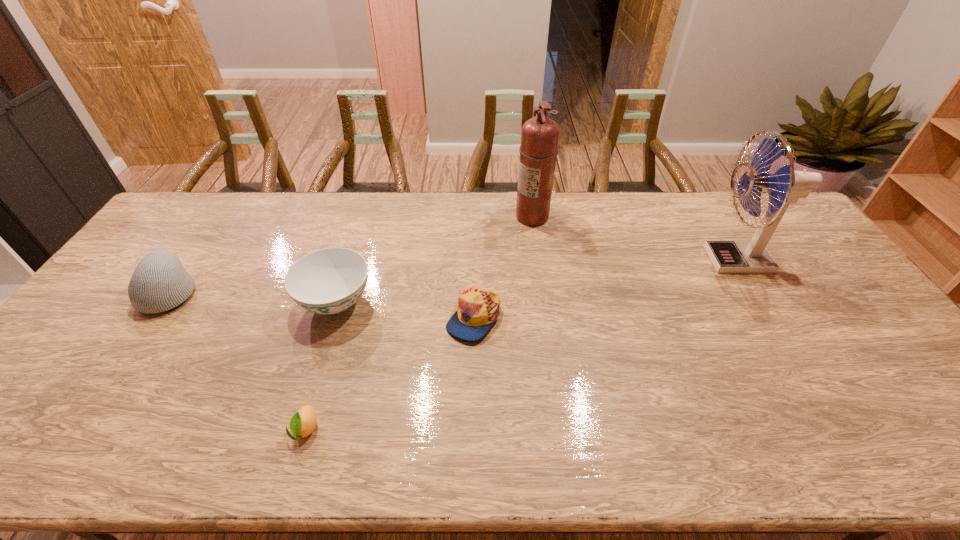
Identify the location of free space located on the front-facing side of the fifth object from left to right. Image resolution: width=960 pixels, height=540 pixels. (429, 217).

The width and height of the screenshot is (960, 540). What are the coordinates of `vacant space located 0.340m on the front-facing side of the fifth object from left to right` in the screenshot? It's located at (418, 217).

The width and height of the screenshot is (960, 540). What are the coordinates of `vacant space positioned on the front-facing side of the fan` in the screenshot? It's located at (576, 260).

The height and width of the screenshot is (540, 960). Identify the location of free region located 0.060m on the front-facing side of the fan. (684, 260).

Locate an element on the screen. The height and width of the screenshot is (540, 960). vacant space located on the front-facing side of the fan is located at coordinates (621, 260).

The image size is (960, 540). Identify the location of vacant space situated 0.370m on the right of the leftmost object. (324, 292).

You are a GUI agent. You are given a task and a screenshot of the screen. Output one action in this format:
    pyautogui.click(x=<x>, y=<y>)
    Task: Click on the free space located 0.170m on the front of the chinaware
    Image resolution: width=960 pixels, height=540 pixels.
    Given the screenshot: What is the action you would take?
    pyautogui.click(x=309, y=388)

You are a GUI agent. You are given a task and a screenshot of the screen. Output one action in this format:
    pyautogui.click(x=<x>, y=<y>)
    Task: Click on the blank area located 0.090m on the bill of the cap
    
    Given the screenshot: What is the action you would take?
    pyautogui.click(x=472, y=374)

Find the location of a particular element. The height and width of the screenshot is (540, 960). object located in the far edge section of the desktop is located at coordinates (538, 150).

You are a GUI agent. You are given a task and a screenshot of the screen. Output one action in this format:
    pyautogui.click(x=<x>, y=<y>)
    Task: Click on the object at the near edge
    This screenshot has height=540, width=960.
    Given the screenshot: What is the action you would take?
    pyautogui.click(x=303, y=422)